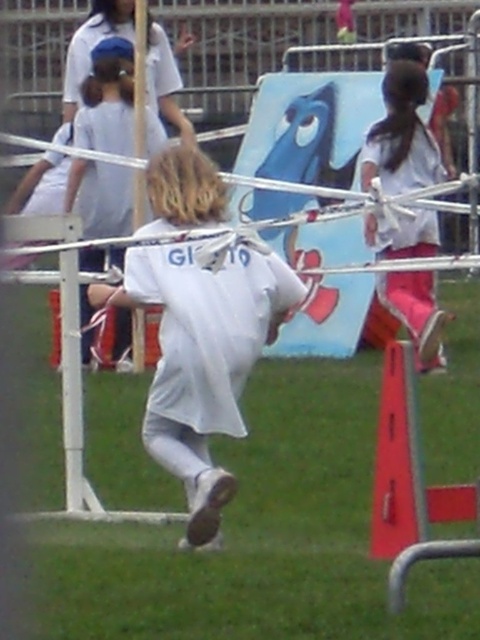
Who is more distant from viewer, [229,364] or [408,280]?

The point [408,280] is behind.

Which is more to the left, white matte shirt at center or pink fabric pants at right?

From the viewer's perspective, white matte shirt at center appears more on the left side.

This screenshot has width=480, height=640. What are the coordinates of `white matte shirt at center` in the screenshot? It's located at (202, 356).